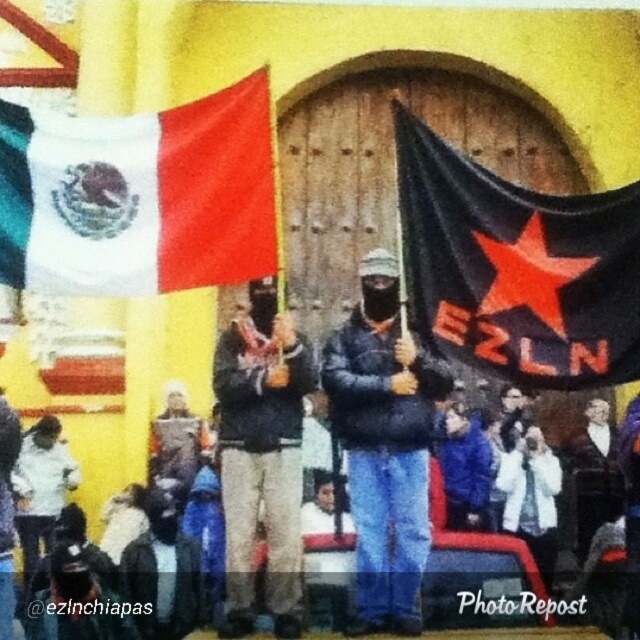
Does matte black jacket at center have a greater height compared to dark gray fabric jacket at center?

Yes, matte black jacket at center is taller than dark gray fabric jacket at center.

Between matte black jacket at center and dark gray fabric jacket at center, which one appears on the left side from the viewer's perspective?

Positioned to the left is dark gray fabric jacket at center.

Which is in front, point (433, 397) or point (298, 385)?

Point (298, 385)

The width and height of the screenshot is (640, 640). I want to click on matte black jacket at center, so click(x=385, y=445).

Who is shorter, black fabric banner at center or dark blue jacket at lower center?

With less height is dark blue jacket at lower center.

Is black fabric banner at center wider than dark blue jacket at lower center?

No.

The width and height of the screenshot is (640, 640). Identify the location of black fabric banner at center. (516, 268).

Which is behind, point (20, 186) or point (419, 488)?

Point (419, 488)

The width and height of the screenshot is (640, 640). Identify the location of white fabric flag at upper left. (140, 196).